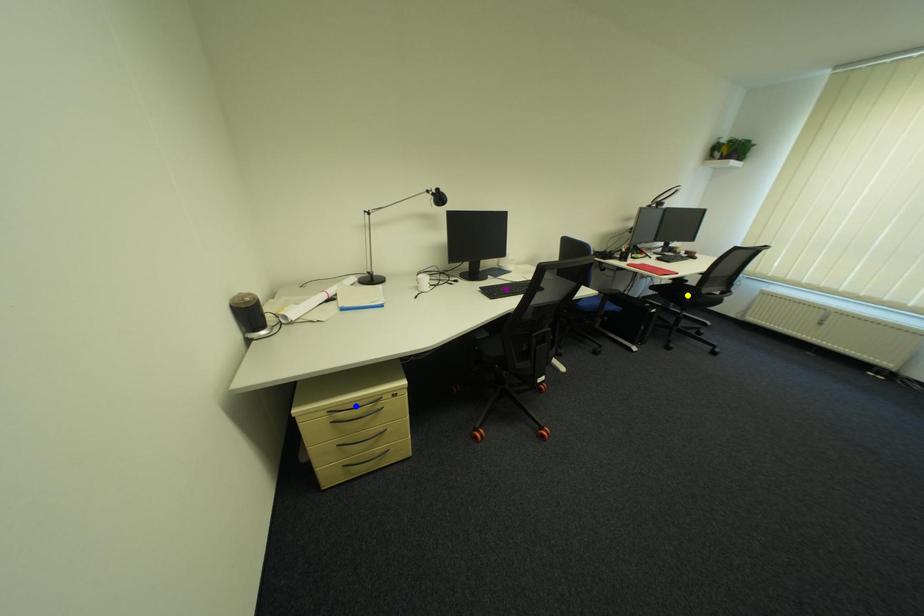
Order these from nearest to farthest:
1. blue point
2. purple point
3. yellow point

blue point
purple point
yellow point